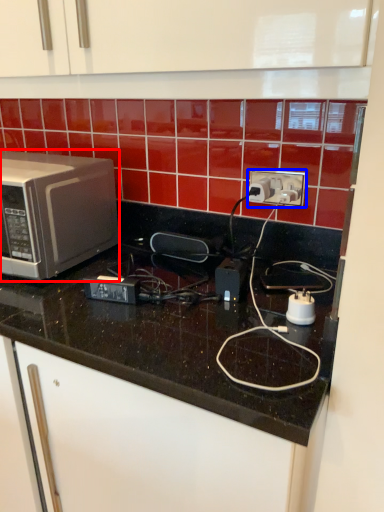
Question: Which object is further to the camera taking this photo, microwave oven (highlighted by a red box) or power plugs and sockets (highlighted by a blue box)?

Choices:
 (A) microwave oven
 (B) power plugs and sockets

Answer: (B)